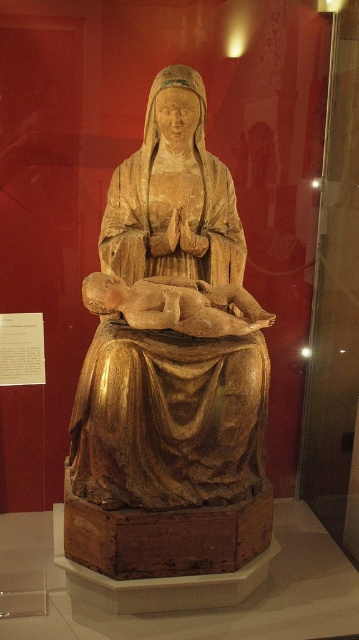
Based on the photo, you are a museum visitor standing in front of the golden polished wood statue at center and the golden wood statue at center. Which one is positioned to the left?

The golden polished wood statue at center is positioned to the left of the golden wood statue at center.

You are a museum curator planning to install a protective glass case around the golden polished wood statue at center and the matte wood baby at center. The case must be at least 12 inches wide to accommodate both objects. Based on their current spacing, will the case need to be adjusted to fit both objects comfortably?

The golden polished wood statue at center is 11.52 inches from the matte wood baby at center. Since the required case width is 12 inches, the current spacing is just under the minimum requirement. The case may need slight adjustment to ensure both objects fit comfortably with adequate space.